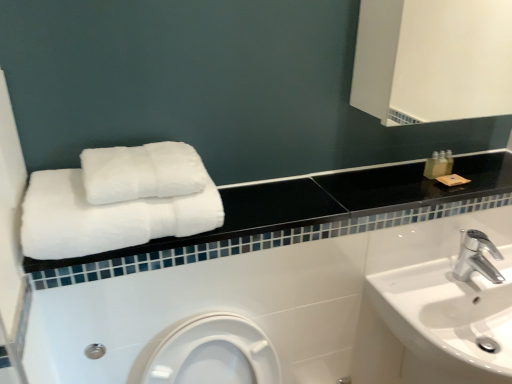
Where is `unoccupied region to the right of silver metallic faucet at lower right`? This screenshot has width=512, height=384. unoccupied region to the right of silver metallic faucet at lower right is located at coordinates (494, 270).